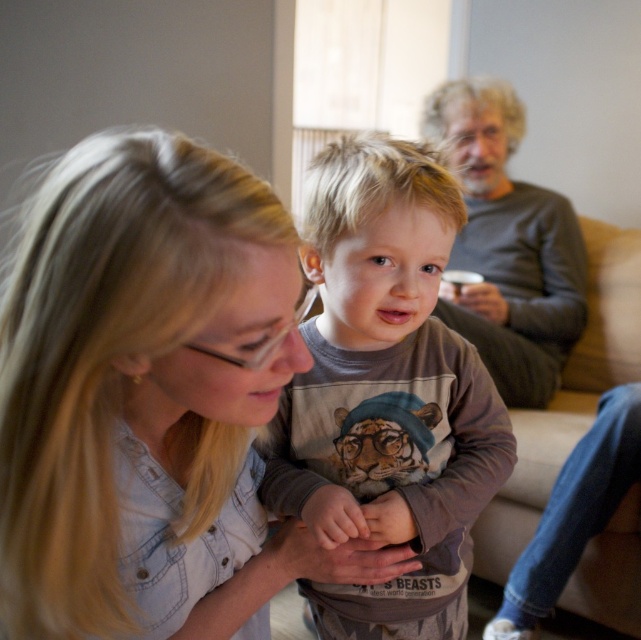
You are standing in the room and want to find the denim shirt at center. According to the coordinates provided, where should you look to locate it?

The denim shirt at center is located at coordinates point (151, 401).

You are standing in the room and want to hand a toy to the person wearing the denim shirt at center and the gray sweater at upper right. Which one can you reach without moving from your current position?

The denim shirt at center is closer to the viewer than the gray sweater at upper right, so you can reach the person wearing the denim shirt at center without moving, but you might need to move closer to reach the gray sweater at upper right.

You are designing a clothing display and need to place the denim shirt at center and brown cotton shirt at center side by side. Which shirt should be placed on the left to ensure they fit within the display area?

The denim shirt at center should be placed on the left since it is wider than the brown cotton shirt at center, allowing for proper spacing in the display area.